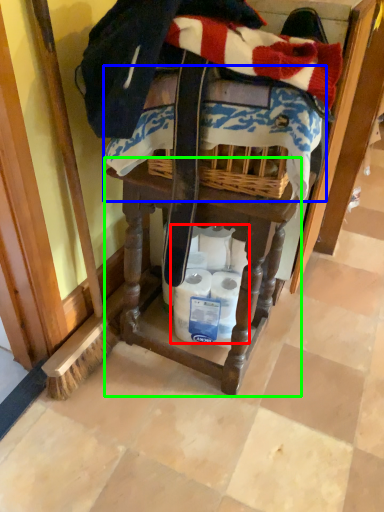
Question: Based on their relative distances, which object is farther from toilet paper (highlighted by a red box)? Choose from underclothes (highlighted by a blue box) and vanity (highlighted by a green box).

Choices:
 (A) underclothes
 (B) vanity

Answer: (A)